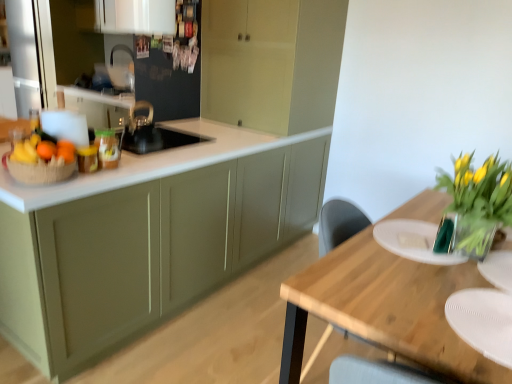
Question: Considering the positions of point (64, 177) and point (377, 223), is point (64, 177) closer or farther from the camera than point (377, 223)?

Choices:
 (A) closer
 (B) farther

Answer: (A)

Question: Based on their positions, is brown woven basket at left located to the left or right of white matte plate at right, the 2th plate when ordered from front to back?

Choices:
 (A) left
 (B) right

Answer: (A)

Question: Which of these objects is positioned farthest from the white matte plate at lower right, marked as the 2th plate in a back-to-front arrangement?

Choices:
 (A) translucent glass vase at right
 (B) white matte plate at right, the second plate from the bottom
 (C) matte green cabinets at center, the third cabinetry in the front-to-back sequence
 (D) brown woven basket at left
 (E) orange matte at left

Answer: (C)

Question: Which is farther from the shiny yellow bananas at left?

Choices:
 (A) matte green cabinets at center, the third cabinetry in the front-to-back sequence
 (B) white glossy cabinet at upper center, placed as the fourth cabinetry when sorted from front to back
 (C) translucent glass vase at right
 (D) brown woven basket at left
 (E) orange matte at left

Answer: (C)